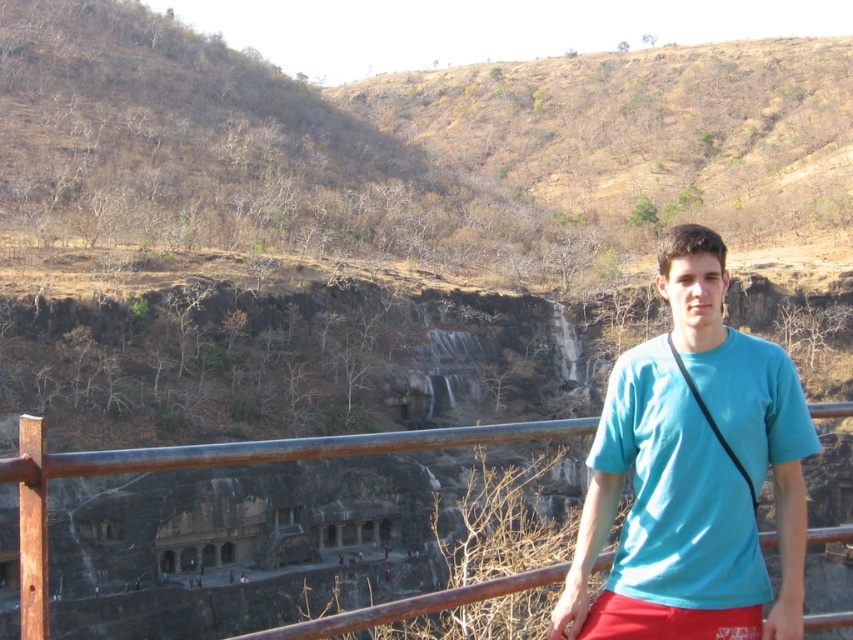
You are a photographer trying to capture a photo of the teal matte shirt at center and the red cotton shorts at lower right. Which object should you focus on first if you want to ensure both are in focus?

The teal matte shirt at center is much taller than the red cotton shorts at lower right. To ensure both are in focus, focus on the teal matte shirt at center since it is farther away, as depth of field typically extends further behind the point of focus than in front.

You are a photographer trying to capture the entire scene in one shot. Given that the teal matte shirt at center and the rusty metal fence at center are both in your frame, which object would appear shorter in the photograph?

The teal matte shirt at center is not as tall as the rusty metal fence at center, so it would appear shorter in the photograph.

In the scene shown: You are a photographer trying to capture both the teal matte shirt at center and the rusty metal fence at center in a single frame. Based on their sizes, which object should you focus on first to ensure both are in the shot?

The teal matte shirt at center has a smaller size compared to the rusty metal fence at center, so you should focus on the rusty metal fence at center first to ensure both are in the shot.